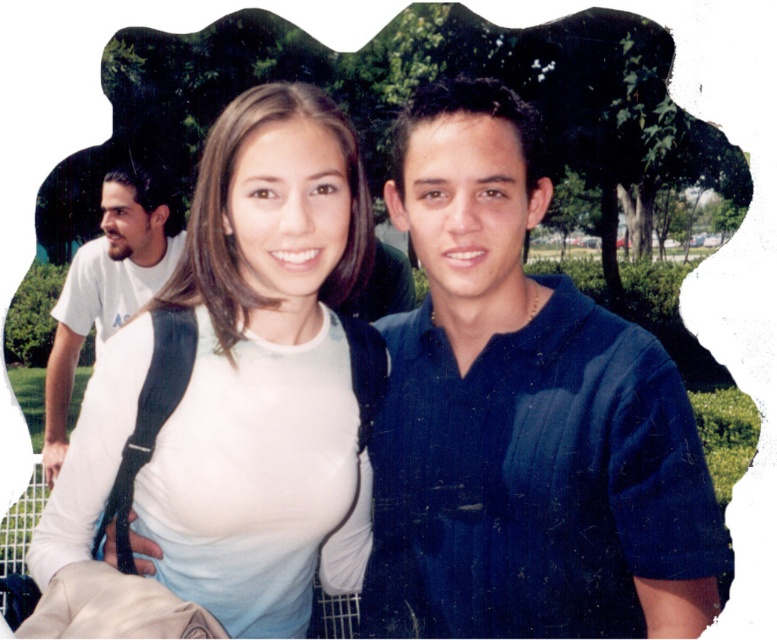
Is dark blue shirt at center positioned behind white matte shirt at center?

Yes, dark blue shirt at center is behind white matte shirt at center.

Locate an element on the screen. dark blue shirt at center is located at coordinates (521, 417).

You are a GUI agent. You are given a task and a screenshot of the screen. Output one action in this format:
    pyautogui.click(x=<x>, y=<y>)
    Task: Click on the dark blue shirt at center
    
    Given the screenshot: What is the action you would take?
    pyautogui.click(x=521, y=417)

In the scene shown: Which is more to the right, white matte shirt at center or white t-shirt at left?

white matte shirt at center

Does white matte shirt at center have a lesser height compared to white t-shirt at left?

Yes, white matte shirt at center is shorter than white t-shirt at left.

Between point (105, 372) and point (65, 403), which one is positioned behind?

Positioned behind is point (65, 403).

The image size is (777, 640). I want to click on white matte shirt at center, so click(241, 385).

Can you confirm if dark blue shirt at center is smaller than white t-shirt at left?

Correct, dark blue shirt at center occupies less space than white t-shirt at left.

Does dark blue shirt at center have a larger size compared to white t-shirt at left?

Incorrect, dark blue shirt at center is not larger than white t-shirt at left.

Who is more distant from viewer, (495, 545) or (119, 259)?

Point (119, 259)

What are the coordinates of `dark blue shirt at center` in the screenshot? It's located at (521, 417).